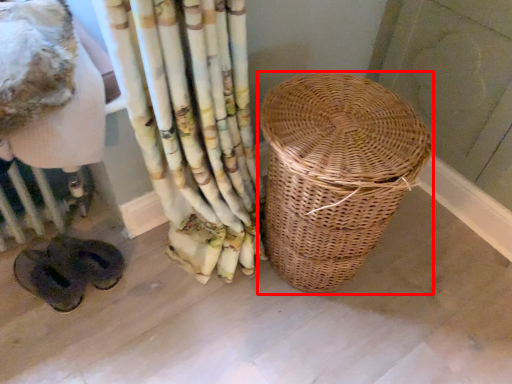
Question: Observing the image, what is the correct spatial positioning of picnic basket (annotated by the red box) in reference to radiator?

Choices:
 (A) right
 (B) left

Answer: (A)